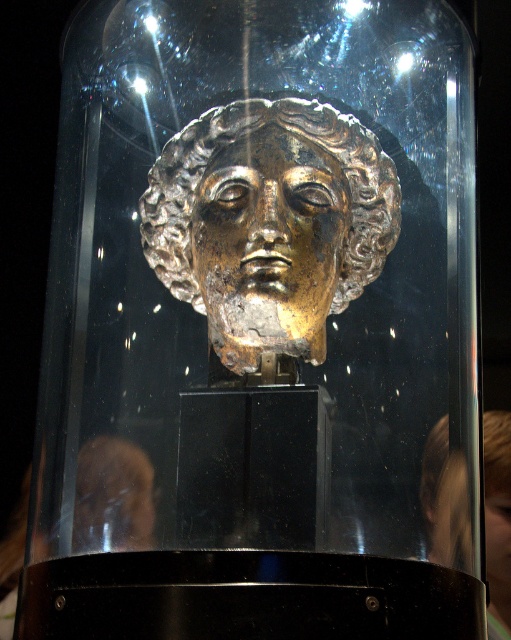
You are a museum curator examining the artifact displayed in the glass dome. You notice a specific point on the head at coordinates point (269, 230). Based on the description, which part of the gold gilded bronze head at center is this point likely indicating?

The point (269, 230) corresponds to the gold gilded bronze head at center, which is the main artifact displayed within the glass dome. Since the coordinates are specified as the center point, it likely indicates the central area of the head, possibly the forehead or the crown, given the description of its position.